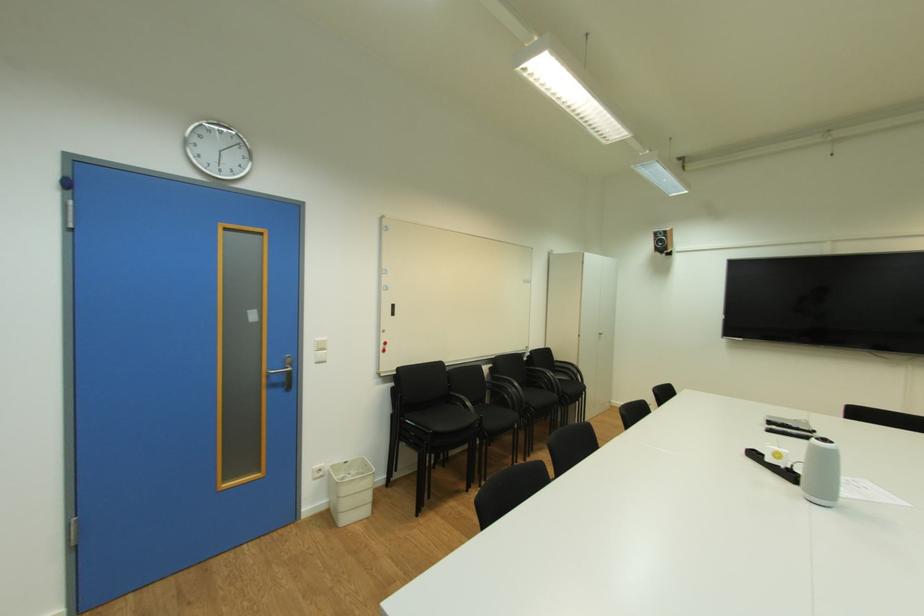
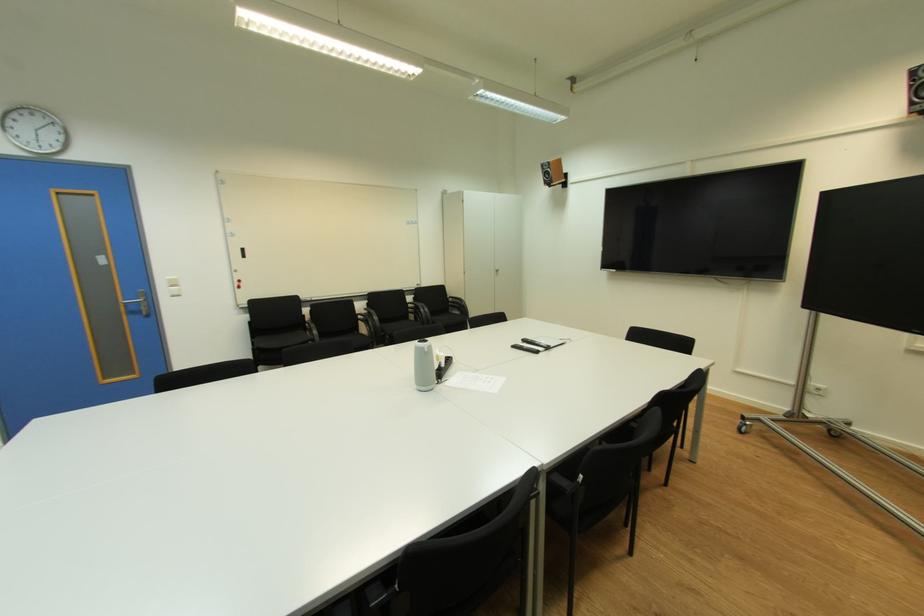
Question: Which direction would the cameraman need to move to produce the second image? Reply with the corresponding letter.

Choices:
 (A) Left
 (B) Right
 (C) Forward
 (D) Backward

Answer: (B)